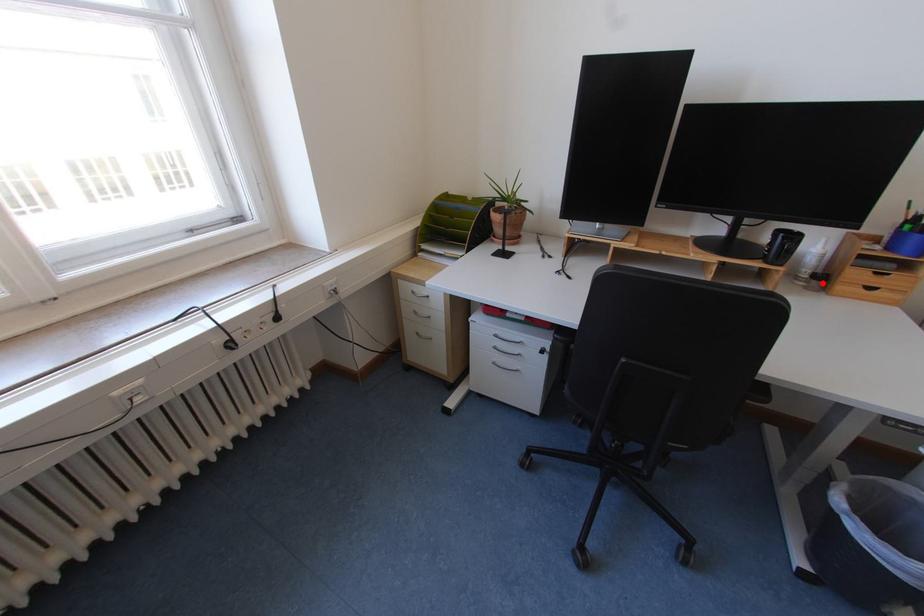
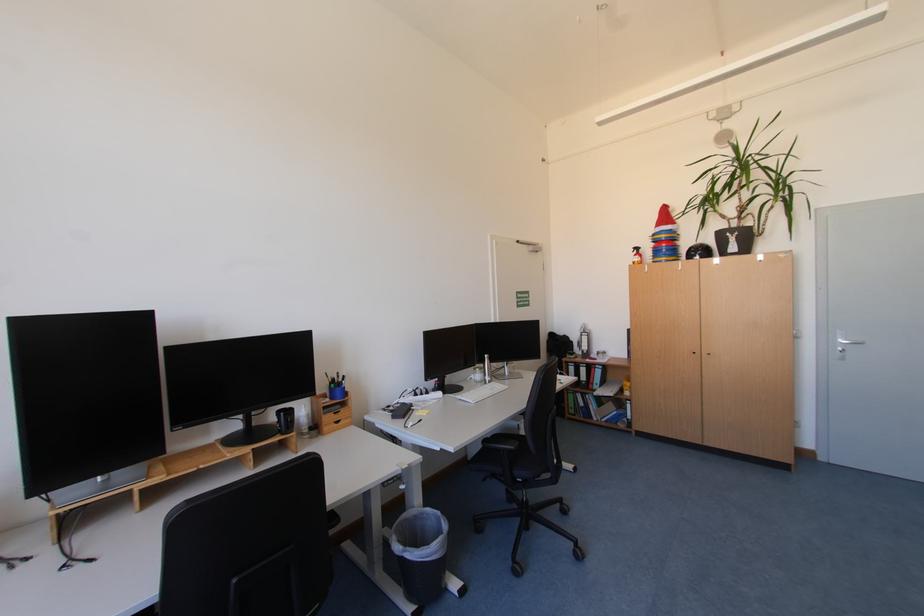
The point at the highlighted location is marked in the first image. Where is the corresponding point in the second image?

(321, 432)